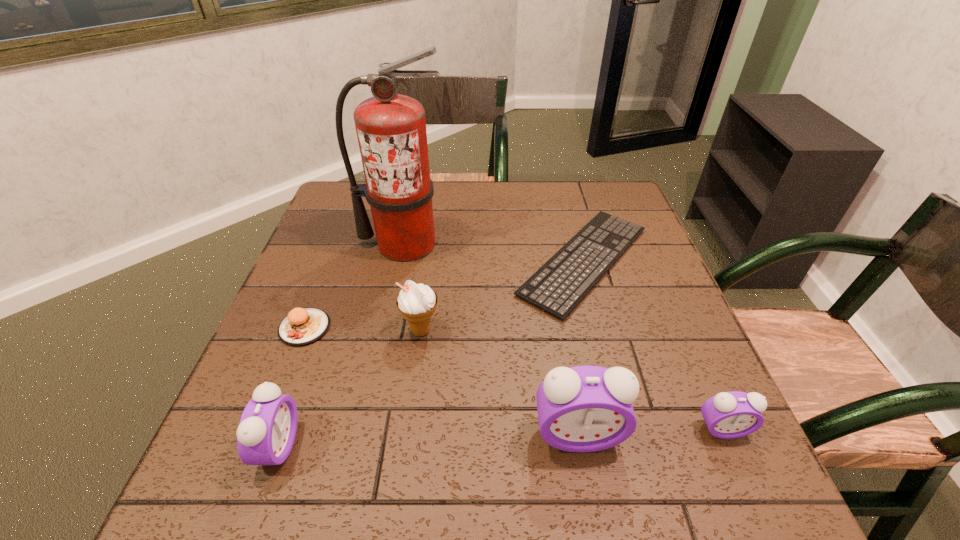
The image size is (960, 540). Identify the location of unoccupied position between the shortest alarm clock and the patty. (514, 378).

I want to click on unoccupied area between the computer keyboard and the rightmost alarm clock, so pos(654,345).

Find the location of a particular element. The height and width of the screenshot is (540, 960). unoccupied position between the computer keyboard and the patty is located at coordinates (444, 294).

Find the location of a particular element. This screenshot has height=540, width=960. free space between the third shortest object and the fourth shortest object is located at coordinates (501, 437).

At what (x,y) coordinates should I click in order to perform the action: click on vacant area that lies between the fifth tallest object and the tallest alarm clock. Please return your answer as a coordinate pair (x, y). The width and height of the screenshot is (960, 540). Looking at the image, I should click on [650, 431].

The width and height of the screenshot is (960, 540). Find the location of `vacant region between the fire extinguisher and the patty`. vacant region between the fire extinguisher and the patty is located at coordinates (354, 286).

I want to click on free space that is in between the leftmost alarm clock and the rightmost alarm clock, so click(x=501, y=437).

Locate which object ranks third in proximity to the second shortest alarm clock. Please provide its 2D coordinates. Your answer should be formatted as a tuple, i.e. [(x, y)], where the tuple contains the x and y coordinates of a point satisfying the conditions above.

[(585, 408)]

In order to click on the fourth closest object to the tallest alarm clock in this screenshot , I will do `click(266, 433)`.

Select which alarm clock is the second closest to the icecream. Please provide its 2D coordinates. Your answer should be formatted as a tuple, i.e. [(x, y)], where the tuple contains the x and y coordinates of a point satisfying the conditions above.

[(585, 408)]